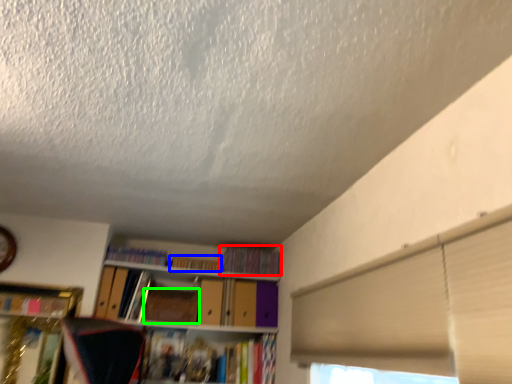
Question: Considering the real-world distances, which object is farthest from book (highlighted by a red box)? book (highlighted by a blue box) or paperback book (highlighted by a green box)?

Choices:
 (A) book
 (B) paperback book

Answer: (B)